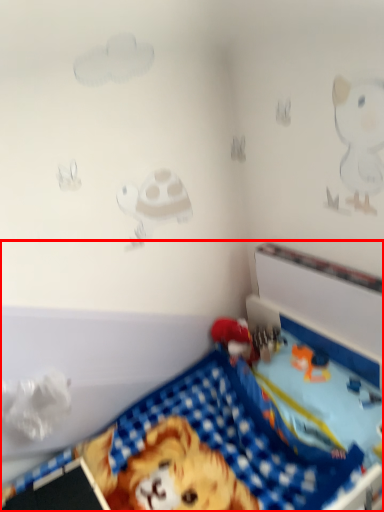
Question: From the image's perspective, considering the relative positions of toy (annotated by the red box) and toy in the image provided, where is toy (annotated by the red box) located with respect to the staircase?

Choices:
 (A) below
 (B) above

Answer: (A)